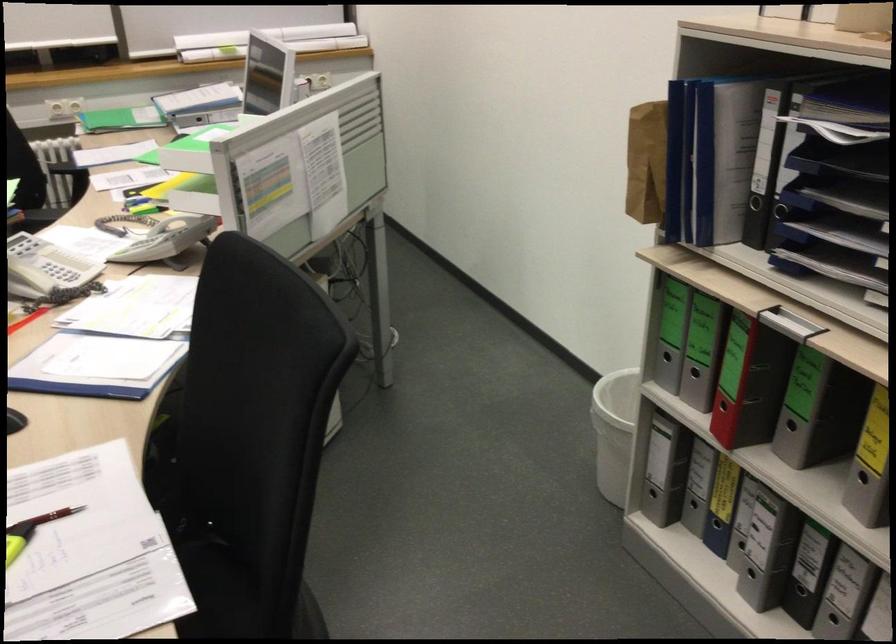
This screenshot has height=644, width=896. In order to click on yellow binder finger hole in this screenshot , I will do tap(863, 477).